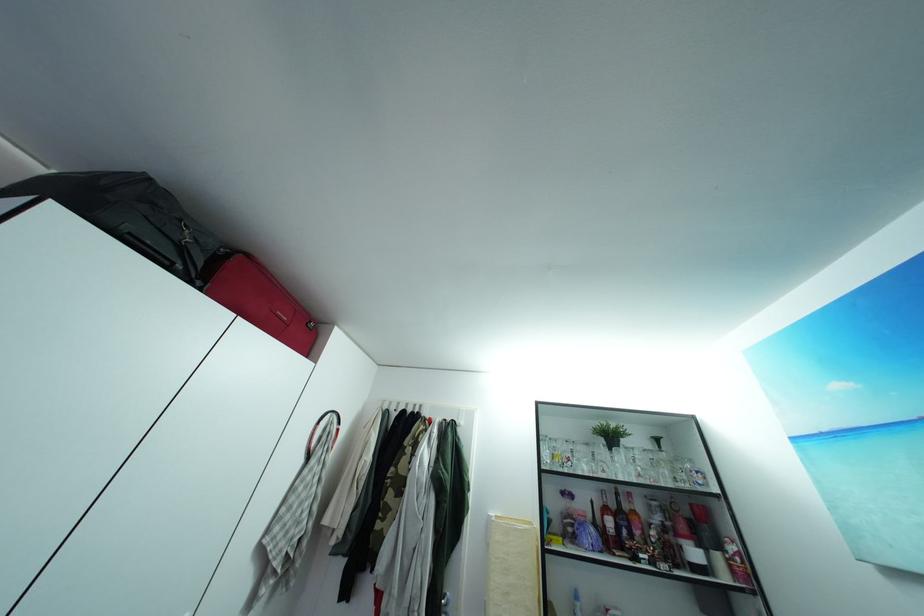
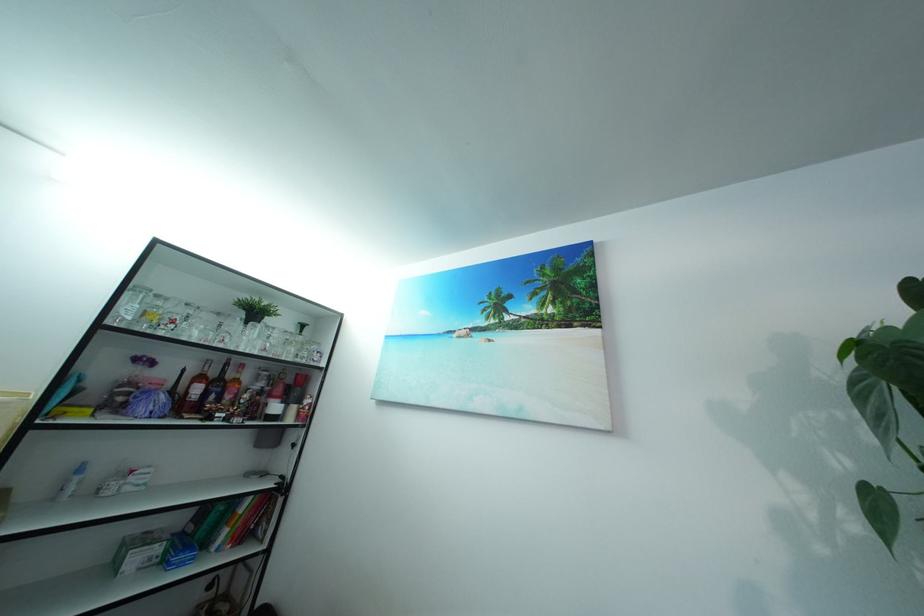
Locate, in the second image, the point that corresponds to (602,532) in the first image.

(179, 399)